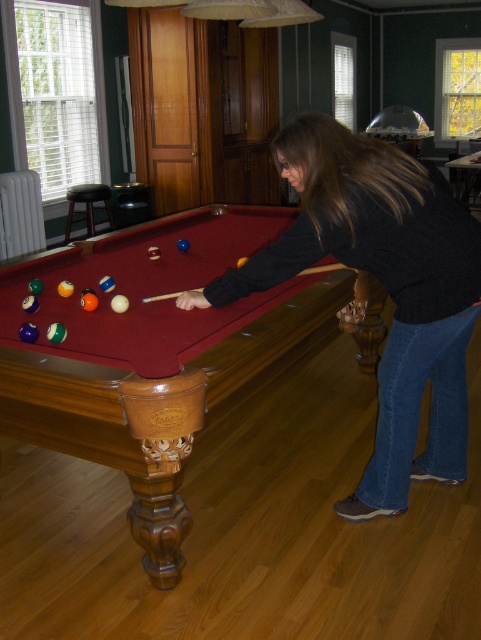
Question: Is black sweater at center smaller than black leather stool at left?

Choices:
 (A) yes
 (B) no

Answer: (B)

Question: Among these points, which one is farthest from the camera?

Choices:
 (A) (27, 353)
 (B) (463, 248)
 (C) (68, 237)

Answer: (C)

Question: Does black sweater at center have a greater width compared to black leather stool at left?

Choices:
 (A) yes
 (B) no

Answer: (A)

Question: Which object appears closest to the camera in this image?

Choices:
 (A) black leather stool at left
 (B) black sweater at center
 (C) wooden pool table at center

Answer: (C)

Question: Does wooden pool table at center come behind black sweater at center?

Choices:
 (A) yes
 (B) no

Answer: (B)

Question: Which object is positioned closest to the black leather stool at left?

Choices:
 (A) black sweater at center
 (B) wooden pool table at center

Answer: (B)